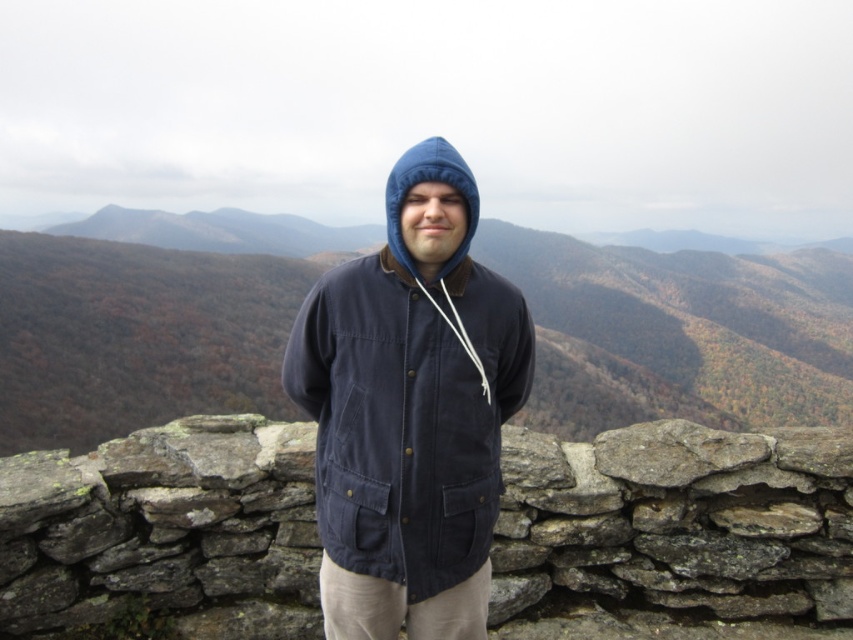
You are a photographer aiming to capture the person in the image while ensuring the gray stone wall at center and the navy corduroy jacket at center are both visible in the frame. Based on their positions, which object should appear higher in the photo?

The navy corduroy jacket at center appears higher in the photo because it is positioned above the gray stone wall at center.

You are a hiker who wants to take a photo of the gray stone wall at center and the brown textured stone wall at center. Which wall should you focus on first to ensure both are in the frame?

You should focus on the gray stone wall at center first because it is closer to you than the brown textured stone wall at center, so adjusting the camera to include both would require starting with the closer one.

Based on the photo, you are a painter standing 12 feet away from the gray stone wall at center. You want to paint the wall but need to be at least 15 feet away to get the entire wall in your view. Can you move back to achieve this?

The gray stone wall at center is 12.58 feet away. Since you need to be at least 15 feet away to capture the entire wall in your view, moving back would allow you to reach the required distance. Yes, you can move back to achieve this.